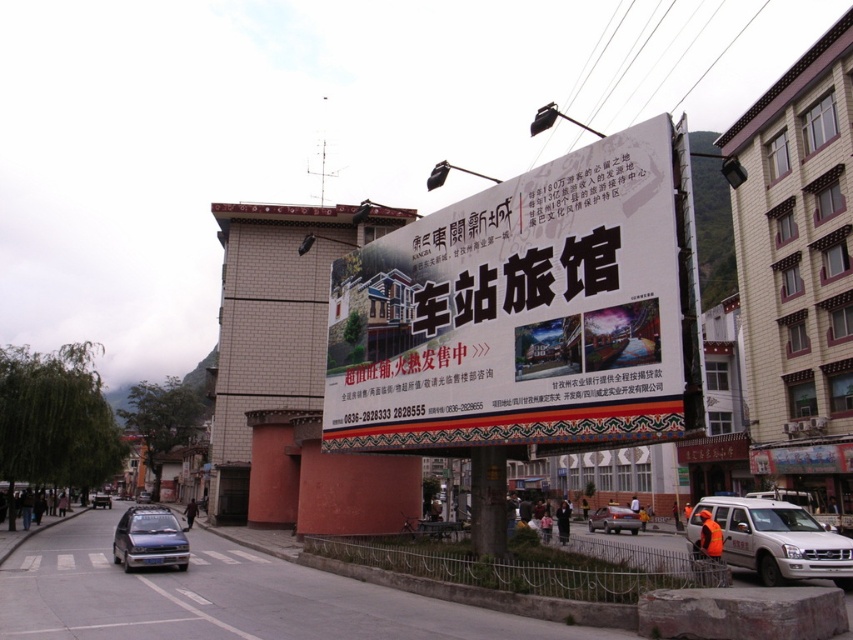
You are standing on the sidewalk in front of the building with the billboard. There are two points marked on the billboard. One is at coordinate point (653, 257) and the other at point (607, 506). Which point is closer to you?

Point (653, 257) is closer to the camera than point (607, 506), so the point at (653, 257) is closer to you.

You are standing on the sidewalk in front of the building with the billboard. There are two points marked on the building wall. One is at coordinate point (624, 522) and the other is at point (91, 500). Which point is closer to you?

The point at coordinate (624, 522) is closer to you than the point at (91, 500).

You are a tourist in a Chinese city and see the white paper billboard at center and the silver metallic sedan at center. Which object is located to the left of the other?

The white paper billboard at center is positioned on the left side of silver metallic sedan at center.